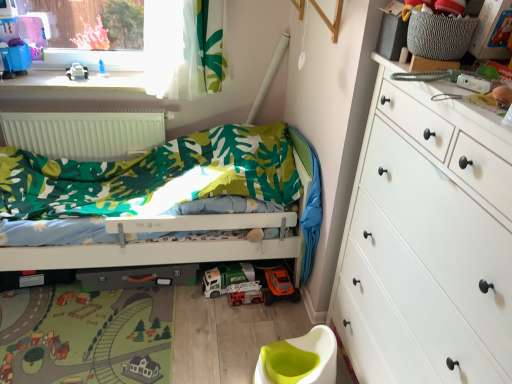
You are a GUI agent. You are given a task and a screenshot of the screen. Output one action in this format:
    pyautogui.click(x=<x>, y=<y>)
    Task: Click on the vacant region above orange matte toy car at lower center (from a real-world perspective)
    The image size is (512, 384).
    Given the screenshot: What is the action you would take?
    pyautogui.click(x=282, y=273)